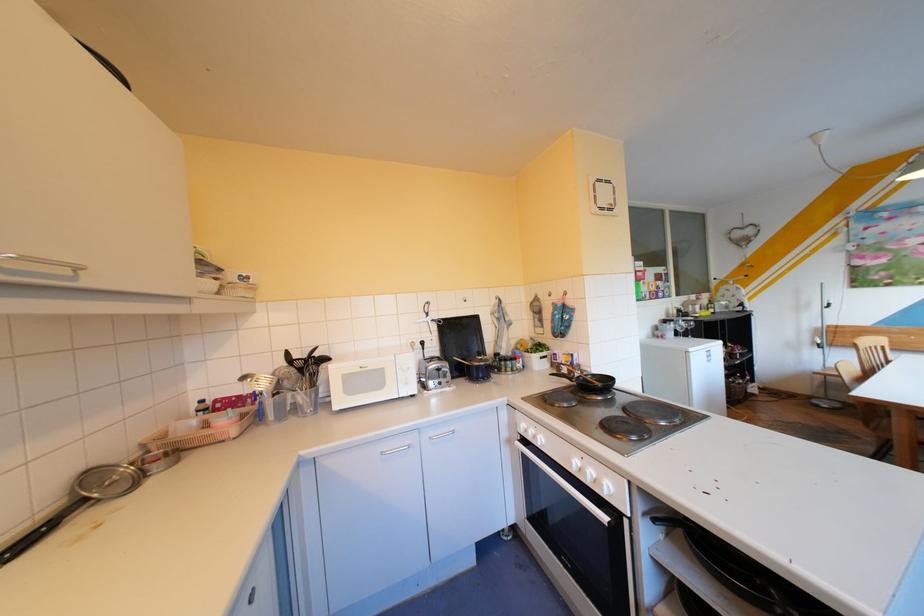
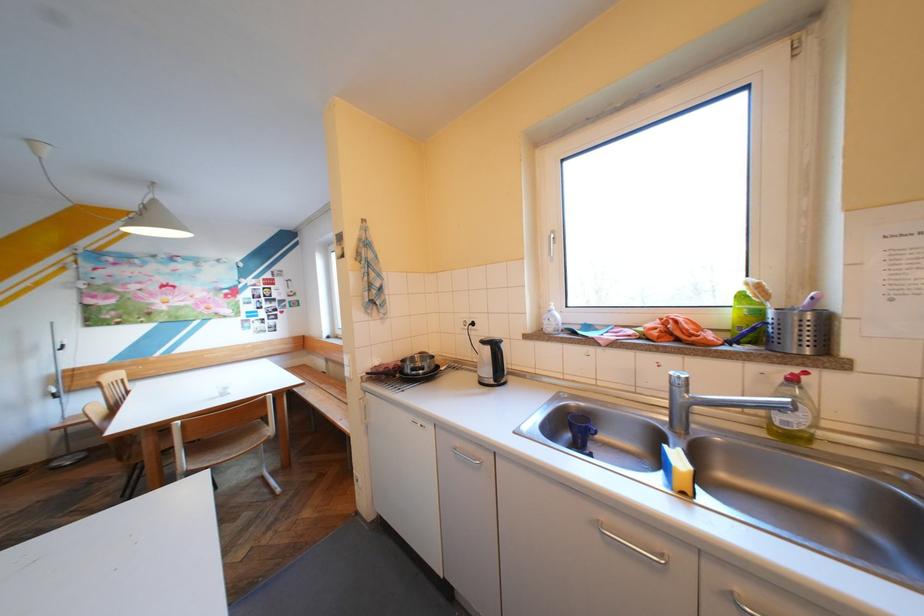
Question: Based on the continuous images, in which direction is the camera rotating? Reply with the corresponding letter.

Choices:
 (A) Left
 (B) Right
 (C) Up
 (D) Down

Answer: (B)